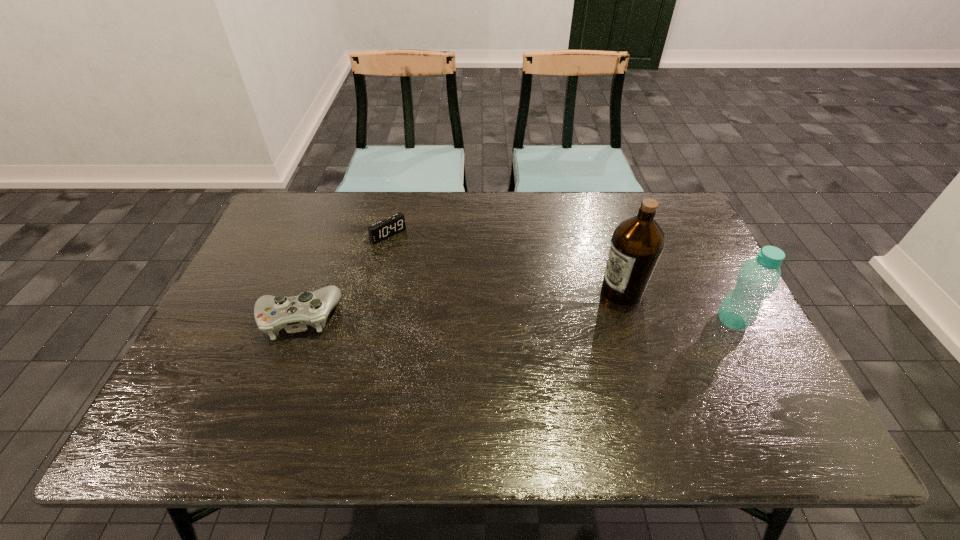
Image resolution: width=960 pixels, height=540 pixels. I want to click on control, so click(272, 313).

I want to click on the leftmost object, so click(272, 313).

This screenshot has width=960, height=540. Find the location of `the rightmost object`. the rightmost object is located at coordinates (759, 277).

The image size is (960, 540). I want to click on the second tallest object, so click(759, 277).

At what (x,y) coordinates should I click in order to perform the action: click on the tallest object. Please return your answer as a coordinate pair (x, y). This screenshot has width=960, height=540. Looking at the image, I should click on 637,243.

Find the location of a particular element. the third object from left to right is located at coordinates (637, 243).

Where is `the farthest object`? This screenshot has height=540, width=960. the farthest object is located at coordinates (384, 229).

Where is `the shortest object`? The width and height of the screenshot is (960, 540). the shortest object is located at coordinates (384, 229).

You are a GUI agent. You are given a task and a screenshot of the screen. Output one action in this format:
    pyautogui.click(x=<x>, y=<y>)
    Task: Click on the vacant space located on the back of the third tallest object
    The image size is (960, 540).
    Given the screenshot: What is the action you would take?
    pyautogui.click(x=339, y=208)

Where is `vacant region located 0.080m on the back of the second tallest object`? vacant region located 0.080m on the back of the second tallest object is located at coordinates (714, 286).